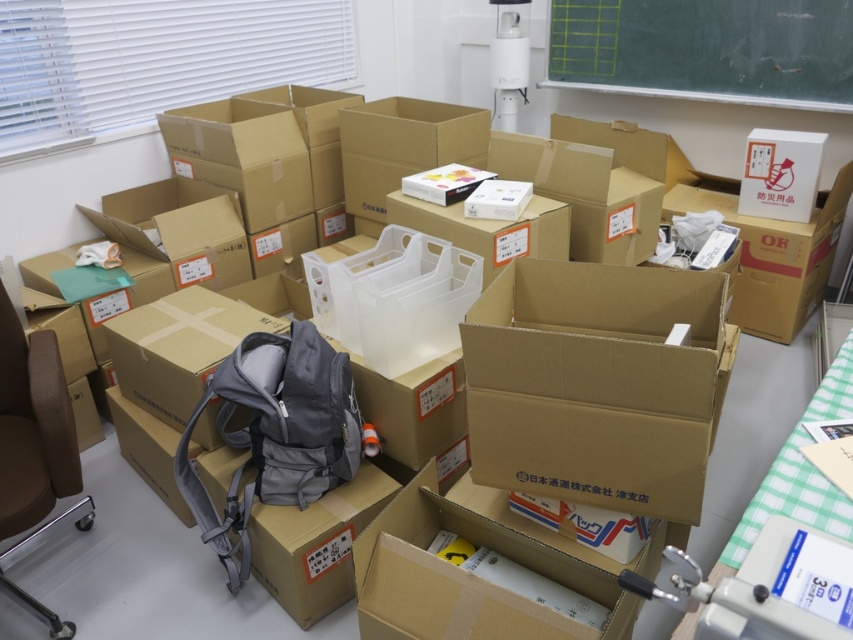
Is gray fabric backpack at center shorter than brown leather swivel chair at left?

Incorrect, gray fabric backpack at center's height does not fall short of brown leather swivel chair at left's.

Is point (213, 378) farther from camera compared to point (30, 339)?

No, (213, 378) is in front of (30, 339).

Is point (233, 586) farther from viewer compared to point (57, 476)?

Yes, point (233, 586) is behind point (57, 476).

The width and height of the screenshot is (853, 640). In order to click on gray fabric backpack at center in this screenshot , I will do coord(276,433).

Is the position of brown leather swivel chair at left more distant than that of green checkered tablecloth at lower right?

Yes, it is.

Who is positioned more to the right, brown leather swivel chair at left or green checkered tablecloth at lower right?

green checkered tablecloth at lower right

Does point (15, 516) come closer to viewer compared to point (775, 467)?

No, it is not.

Locate an element on the screen. The image size is (853, 640). brown leather swivel chair at left is located at coordinates (32, 426).

Is green chalkboard at upper right positioned at the back of green checkered tablecloth at lower right?

Yes, it is.

Can you confirm if green chalkboard at upper right is positioned above green checkered tablecloth at lower right?

Yes, green chalkboard at upper right is above green checkered tablecloth at lower right.

The height and width of the screenshot is (640, 853). Identify the location of green chalkboard at upper right. (706, 49).

At what (x,y) coordinates should I click in order to perform the action: click on green chalkboard at upper right. Please return your answer as a coordinate pair (x, y). The width and height of the screenshot is (853, 640). Looking at the image, I should click on (706, 49).